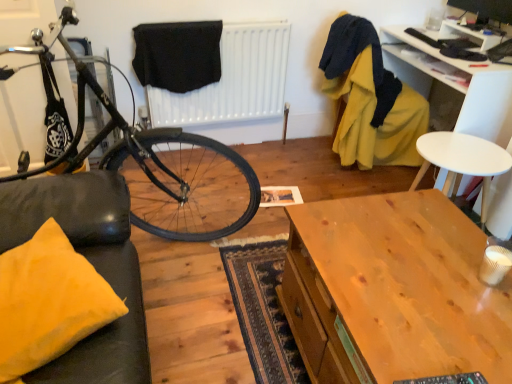
Locate an element on the screen. Image resolution: width=512 pixels, height=384 pixels. free spot above yellow fabric pillow at lower left (from a real-world perspective) is located at coordinates (34, 279).